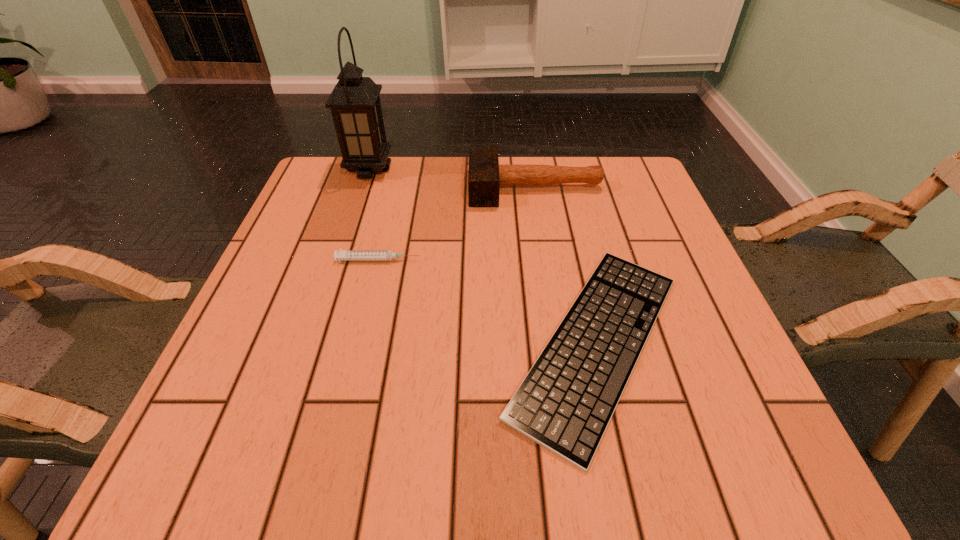
The width and height of the screenshot is (960, 540). Identify the location of lantern located at the far edge. (355, 105).

Locate an element on the screen. Image resolution: width=960 pixels, height=540 pixels. mallet present at the far edge is located at coordinates (485, 175).

Find the location of a particular element. The height and width of the screenshot is (540, 960). object located at the near edge is located at coordinates (565, 403).

This screenshot has width=960, height=540. Find the location of `lantern situated at the left edge`. lantern situated at the left edge is located at coordinates pos(355,105).

Where is `syringe located at the left edge`? This screenshot has height=540, width=960. syringe located at the left edge is located at coordinates (344, 255).

Find the location of a particular element. The width and height of the screenshot is (960, 540). mallet located at the right edge is located at coordinates (485, 175).

Locate an element on the screen. The image size is (960, 540). computer keyboard located at the right edge is located at coordinates [x=565, y=403].

At what (x,y) coordinates should I click in order to perform the action: click on object present at the far left corner. Please return your answer as a coordinate pair (x, y). This screenshot has height=540, width=960. Looking at the image, I should click on (355, 105).

Image resolution: width=960 pixels, height=540 pixels. I want to click on object that is positioned at the far right corner, so click(485, 175).

The width and height of the screenshot is (960, 540). Find the location of `object that is positioned at the near right corner`. object that is positioned at the near right corner is located at coordinates (565, 403).